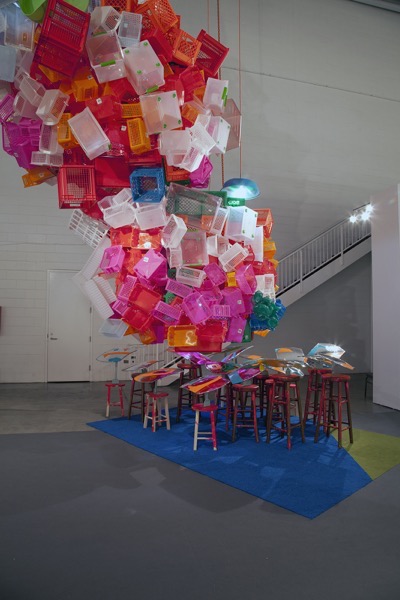
I want to click on blue and green rug, so click(315, 470).